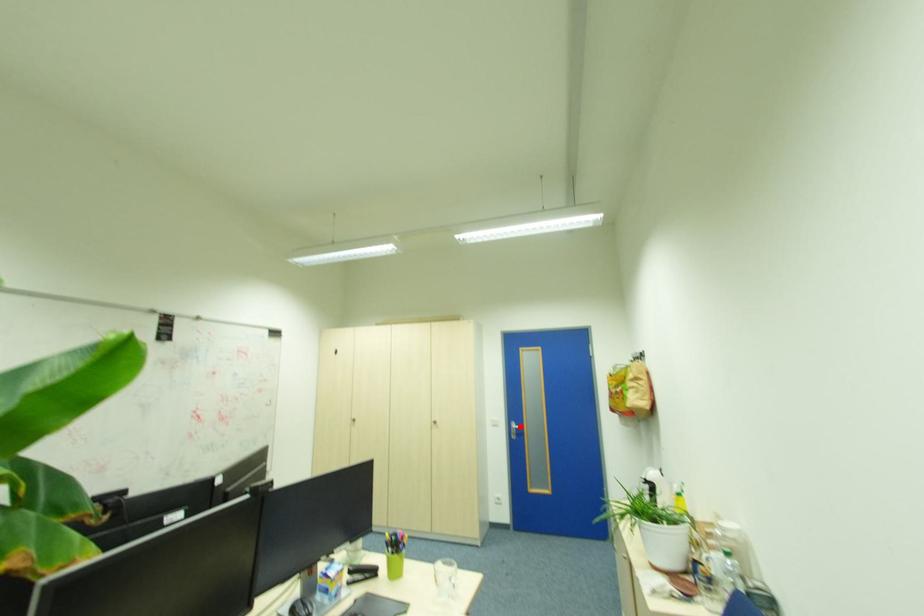
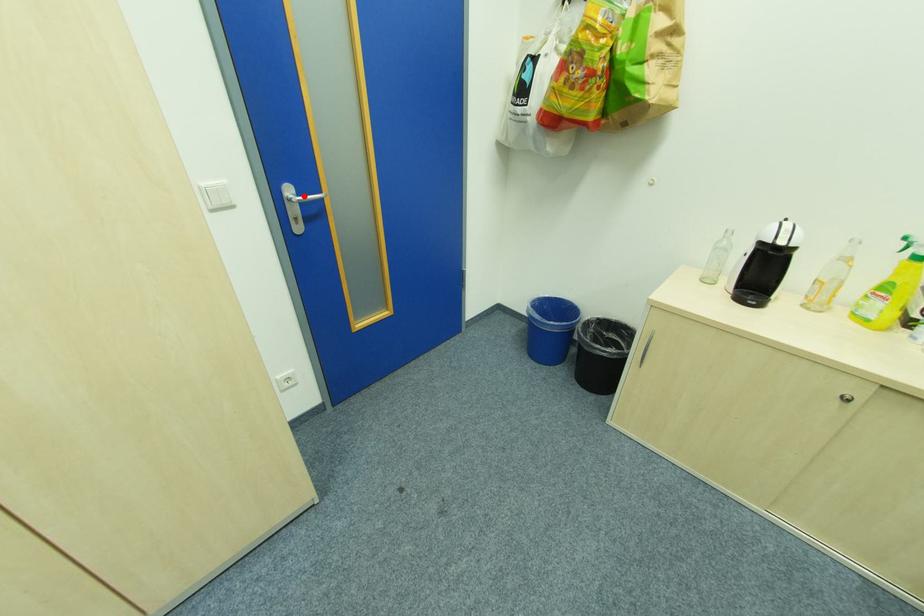
I am providing you with two images of the same scene from different viewpoints. A red point is marked on the first image and another point is marked on the second image. Is the marked point in image1 the same physical position as the marked point in image2?

Yes